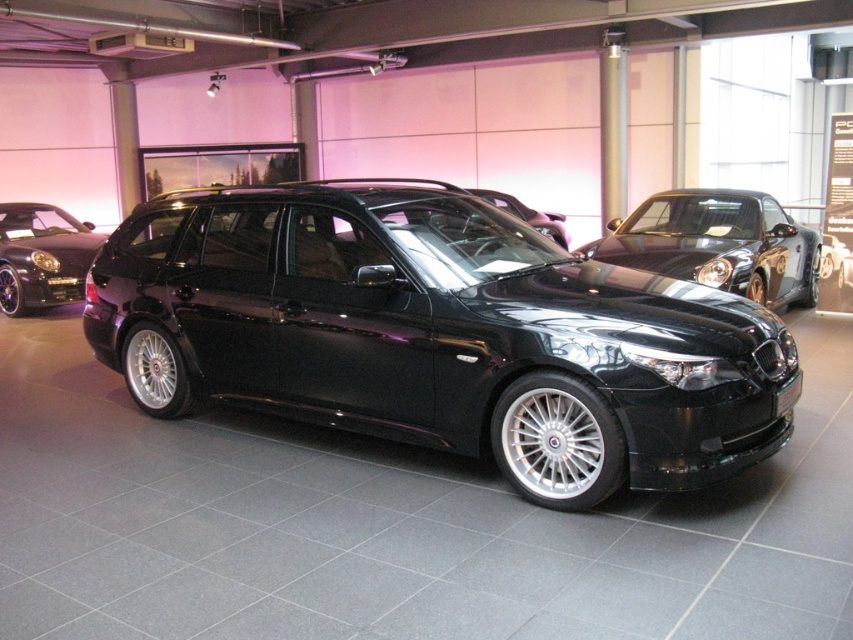
Question: Among these objects, which one is farthest from the camera?

Choices:
 (A) glossy black car at left
 (B) glossy black car at center
 (C) glossy black wagon at center

Answer: (A)

Question: Is glossy black car at center behind glossy black car at left?

Choices:
 (A) yes
 (B) no

Answer: (B)

Question: Is glossy black car at center below glossy black car at left?

Choices:
 (A) no
 (B) yes

Answer: (B)

Question: Does glossy black wagon at center appear on the right side of glossy black car at left?

Choices:
 (A) no
 (B) yes

Answer: (B)

Question: Which point is closer to the camera taking this photo?

Choices:
 (A) (42, 220)
 (B) (759, 220)
 (C) (245, 276)

Answer: (C)

Question: Which of the following is the closest to the observer?

Choices:
 (A) glossy black car at left
 (B) glossy black car at center

Answer: (B)